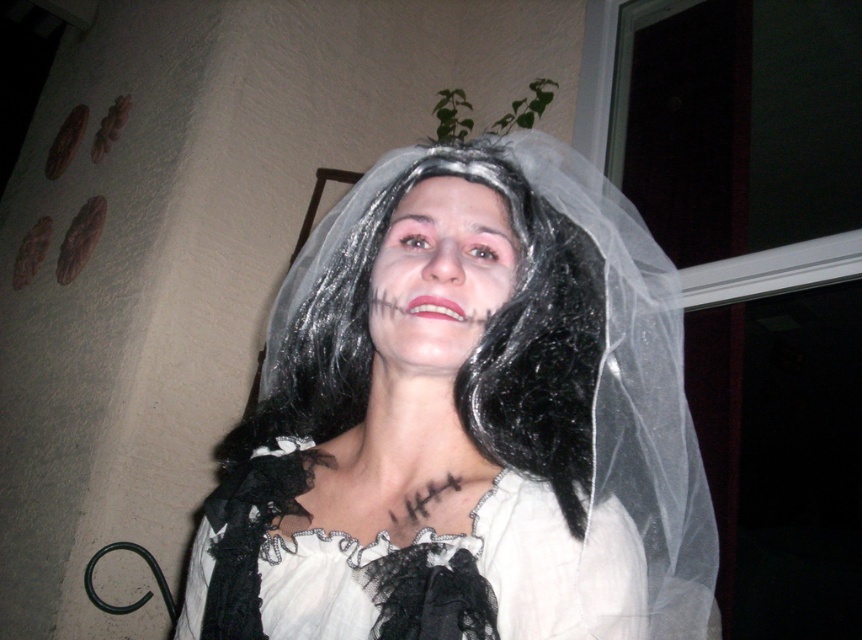
You are a photographer adjusting your camera settings to focus on two points in the scene. The first point is point (504, 381) and the second is point (411, 628). Which point should you focus on first if you want to capture the closest object to the camera?

Point (504, 381) is further to the camera than point (411, 628), so you should focus on point (504, 381) first as it is closer to the camera.

You are a photographer setting up for a Halloween photoshoot. You have two main elements in the scene, the white lace veil at center and the white lace dress at center. Which one is covering the other?

The white lace veil at center is positioned over the white lace dress at center, so the veil is covering the dress.

Looking at this image, based on the description, which object is bigger, the white lace veil at center or the white lace dress at center?

The white lace veil at center is larger in size than the white lace dress at center.